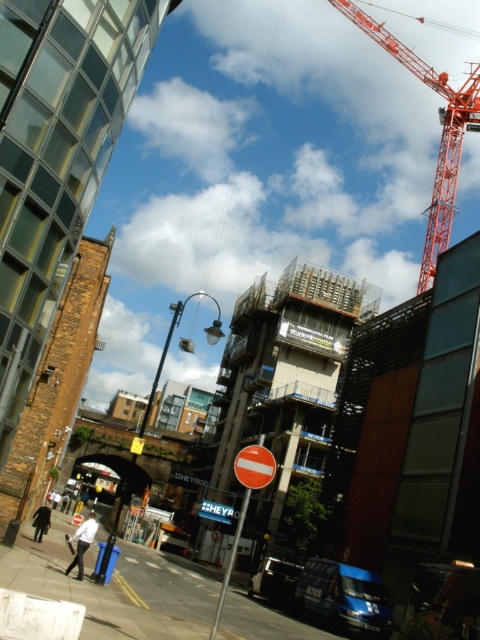
Question: Can you confirm if orange metallic crane at upper right is positioned above red plastic circle at center?

Choices:
 (A) yes
 (B) no

Answer: (A)

Question: Which object appears farthest from the camera in this image?

Choices:
 (A) orange metallic crane at upper right
 (B) red plastic circle at center

Answer: (A)

Question: Is orange metallic crane at upper right wider than metallic rectangular sign at center?

Choices:
 (A) no
 (B) yes

Answer: (B)

Question: Which point appears closest to the camera in this image?

Choices:
 (A) (369, 22)
 (B) (272, 460)

Answer: (B)

Question: Based on their relative distances, which object is farther from the red plastic circle at center?

Choices:
 (A) metallic rectangular sign at center
 (B) orange metallic crane at upper right

Answer: (B)

Question: Is orange metallic crane at upper right in front of red plastic circle at center?

Choices:
 (A) no
 (B) yes

Answer: (A)